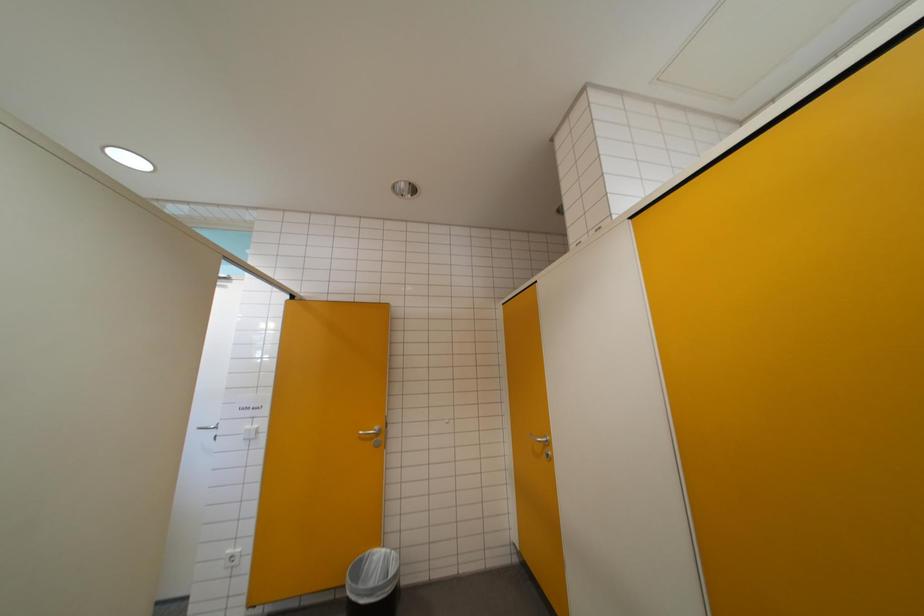
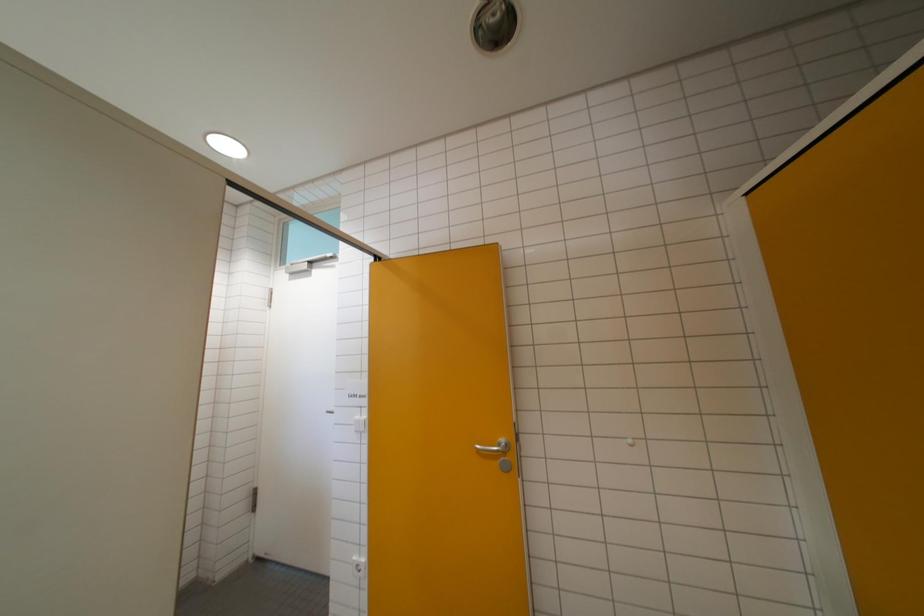
Question: The camera is either moving clockwise (left) or counter-clockwise (right) around the object. The first image is from the beginning of the video and the second image is from the end. Is the camera moving left or right when shooting the video?

Choices:
 (A) Left
 (B) Right

Answer: (B)